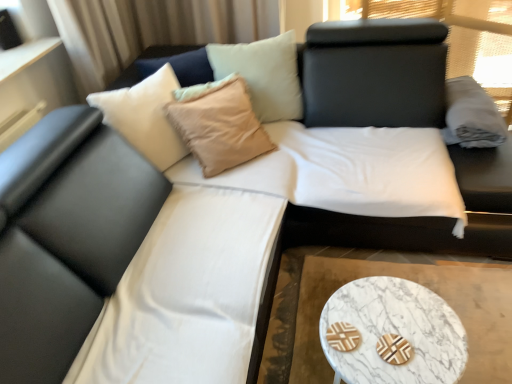
Question: From a real-world perspective, is marble/stone coffee table at lower right physically located above or below beige fabric pillow at upper center?

Choices:
 (A) above
 (B) below

Answer: (B)

Question: Looking at the image, does marble/stone coffee table at lower right seem bigger or smaller compared to beige fabric pillow at upper center?

Choices:
 (A) small
 (B) big

Answer: (B)

Question: Which of these objects is positioned closest to the black leather bed at center?

Choices:
 (A) marble/stone coffee table at lower right
 (B) beige fabric pillow at upper center
 (C) white fabric cushion at center
 (D) white marble cocktail table at lower right
 (E) gray cotton pillow at upper right

Answer: (B)

Question: Estimate the real-world distances between objects in this image. Which object is closer to the beige fabric pillow at upper center?

Choices:
 (A) marble/stone coffee table at lower right
 (B) black leather bed at center
 (C) gray cotton pillow at upper right
 (D) white fabric cushion at center
 (E) white marble cocktail table at lower right

Answer: (B)